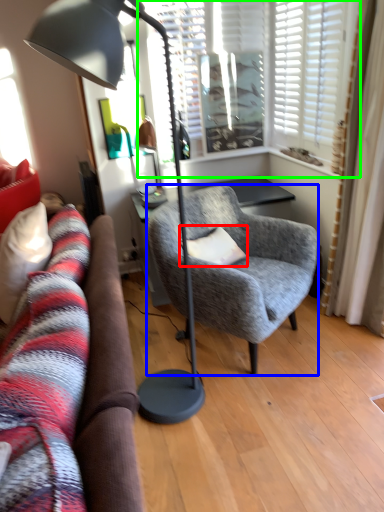
Question: Considering the real-world distances, which object is closest to pillow (highlighted by a red box)? chair (highlighted by a blue box) or window (highlighted by a green box).

Choices:
 (A) chair
 (B) window

Answer: (A)